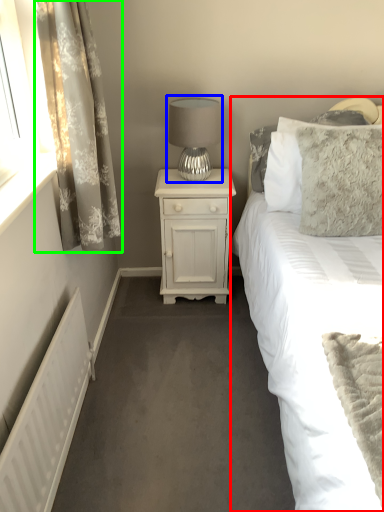
Question: Which object is the closest to the bed (highlighted by a red box)? Choose among these: table lamp (highlighted by a blue box) or curtain (highlighted by a green box).

Choices:
 (A) table lamp
 (B) curtain

Answer: (A)